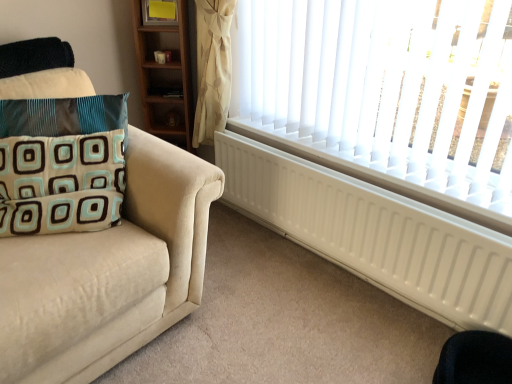
Question: Is white matte radiator at lower right in front of or behind black fabric swivel chair at lower right in the image?

Choices:
 (A) front
 (B) behind

Answer: (B)

Question: Visually, is white matte radiator at lower right positioned to the left or to the right of black fabric swivel chair at lower right?

Choices:
 (A) left
 (B) right

Answer: (A)

Question: Considering the real-world distances, which object is closest to the black fabric swivel chair at lower right?

Choices:
 (A) white matte radiator at lower right
 (B) teal velvet pillow at left

Answer: (A)

Question: Which of these objects is positioned closest to the black fabric swivel chair at lower right?

Choices:
 (A) teal velvet pillow at left
 (B) white matte radiator at lower right

Answer: (B)